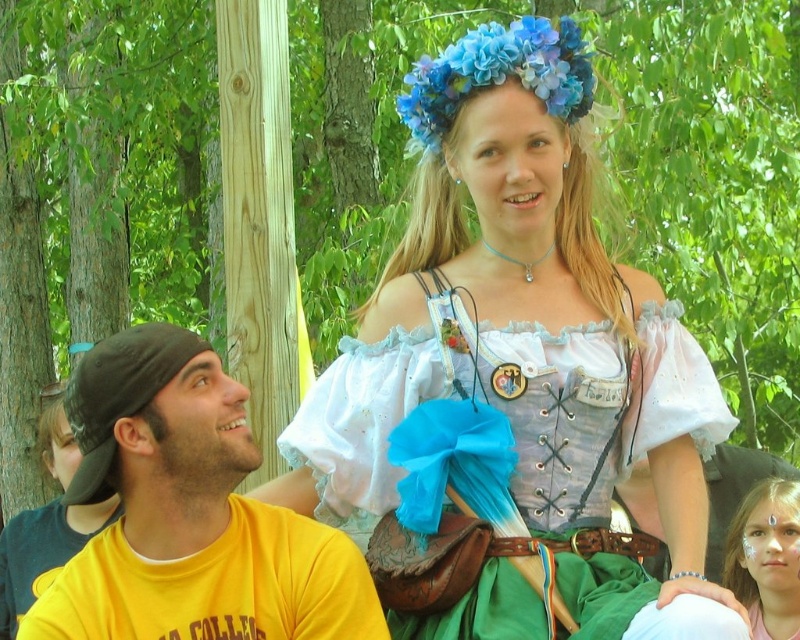
Question: Which point is farther to the camera?

Choices:
 (A) matte pink face paint at lower right
 (B) matte white blouse at center
 (C) yellow cotton t-shirt at lower left

Answer: (A)

Question: Can you confirm if yellow cotton t-shirt at lower left is wider than matte pink face paint at lower right?

Choices:
 (A) no
 (B) yes

Answer: (B)

Question: Is matte white blouse at center smaller than yellow cotton t-shirt at lower left?

Choices:
 (A) no
 (B) yes

Answer: (A)

Question: Among these objects, which one is nearest to the camera?

Choices:
 (A) matte pink face paint at lower right
 (B) yellow cotton t-shirt at lower left
 (C) matte white blouse at center

Answer: (C)

Question: Which object appears closest to the camera in this image?

Choices:
 (A) matte white blouse at center
 (B) yellow cotton t-shirt at lower left
 (C) matte pink face paint at lower right

Answer: (A)

Question: From the image, what is the correct spatial relationship of yellow cotton t-shirt at lower left in relation to matte pink face paint at lower right?

Choices:
 (A) left
 (B) right

Answer: (A)